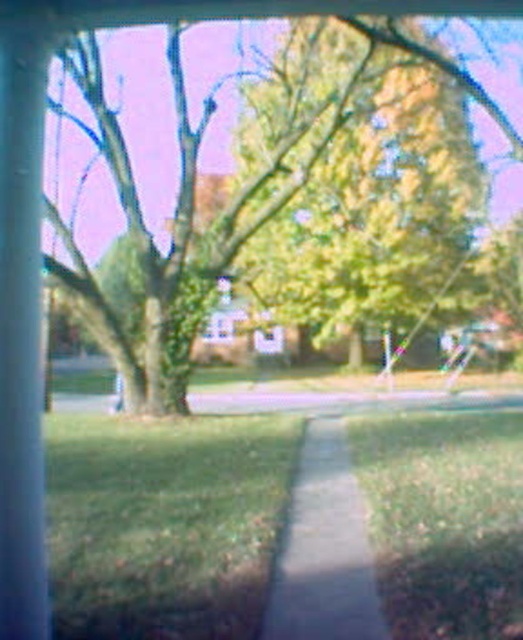
You are a gardener who needs to mow the green grass at lower center and sweep the concrete sidewalk at center. Which area requires more time to cover based on their widths?

The green grass at lower center might be wider than concrete sidewalk at center, so it would likely take more time to mow the green grass at lower center compared to sweeping the narrower concrete sidewalk at center.

You are a gardener who needs to water two patches of green grass at lower left and green grass at lower center. The watering can you have can cover an area up to 2.5 meters in diameter. Can you water both patches with a single pour without moving the can?

The distance between the green grass at lower left and green grass at lower center is 2.66 meters. Since the watering can can only cover up to 2.5 meters, you cannot water both patches with a single pour without moving the can.